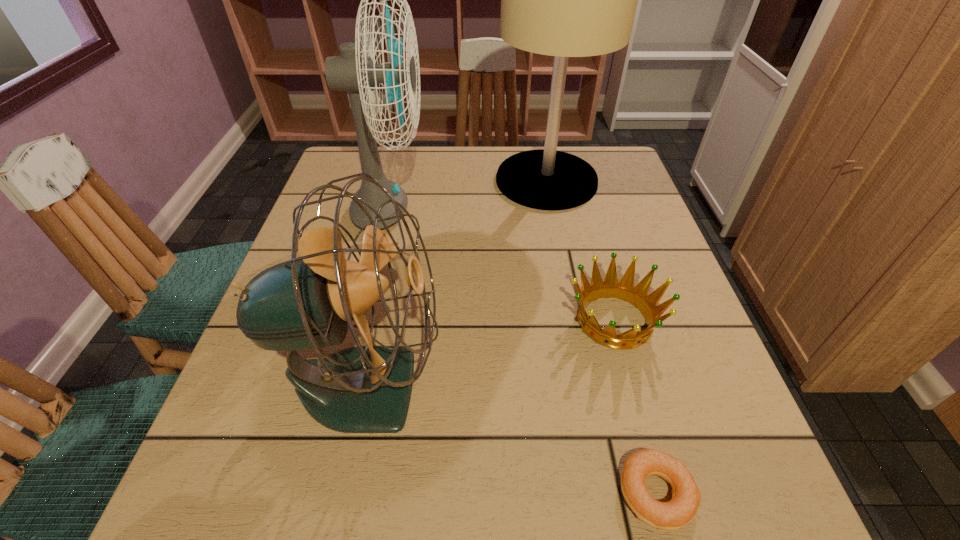
The image size is (960, 540). Find the location of `free location that satisfies the following two spatial constraints: 1. on the front-facing side of the second shortest object; 2. on the left side of the farther fan`. free location that satisfies the following two spatial constraints: 1. on the front-facing side of the second shortest object; 2. on the left side of the farther fan is located at coordinates (364, 320).

Locate an element on the screen. blank space that satisfies the following two spatial constraints: 1. on the front-facing side of the farther fan; 2. on the left side of the bagel is located at coordinates click(322, 493).

Where is `blank space that satisfies the following two spatial constraints: 1. on the front-facing side of the taller fan; 2. on the back side of the bagel`? blank space that satisfies the following two spatial constraints: 1. on the front-facing side of the taller fan; 2. on the back side of the bagel is located at coordinates (322, 493).

Locate an element on the screen. The width and height of the screenshot is (960, 540). vacant space that satisfies the following two spatial constraints: 1. on the front side of the bagel; 2. on the right side of the table lamp is located at coordinates (607, 493).

Locate an element on the screen. The image size is (960, 540). vacant space that satisfies the following two spatial constraints: 1. on the front side of the table lamp; 2. on the front-facing side of the taller fan is located at coordinates (553, 213).